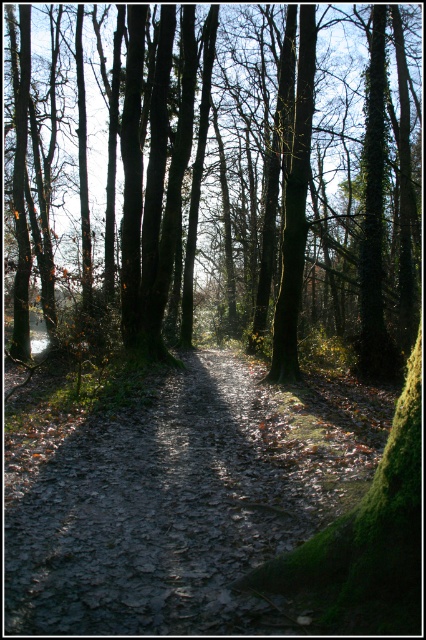
You are a hiker carrying a backpack and want to walk along the muddy dirt path at center without getting too close to the green mossy tree at center. Based on their widths, can you determine if there is enough space to walk safely on the path while avoiding the tree?

The green mossy tree at center might be wider than the muddy dirt path at center, so there may not be enough space to walk safely on the path while avoiding the tree. It is advisable to proceed with caution or choose an alternate route.

You are a hiker who wants to take a photo of the green mossy tree at center. Where should you stand to capture it in the frame?

You should stand at point (219,176) to capture the green mossy tree at center in the frame.

You are a hiker walking along the muddy dirt path at center. You notice a green mossy tree at center blocking your way. Can you walk around it without leaving the path?

The green mossy tree at center is further to the viewer than the muddy dirt path at center, meaning the tree is closer to you. Since the path is narrow and the tree is in front of the path, you cannot walk around it without leaving the path.